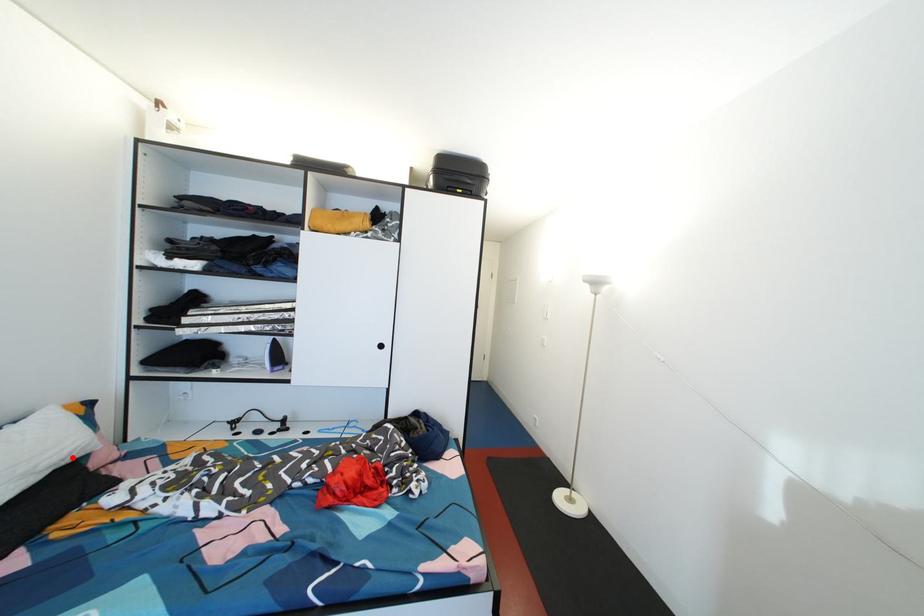
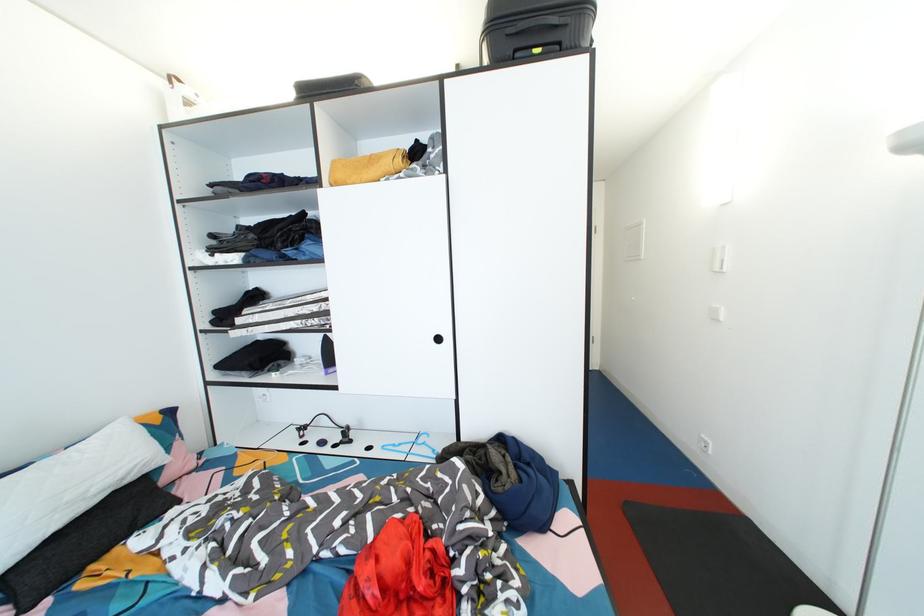
Find the pixel in the second image that matches the highlighted location in the first image.

(128, 477)